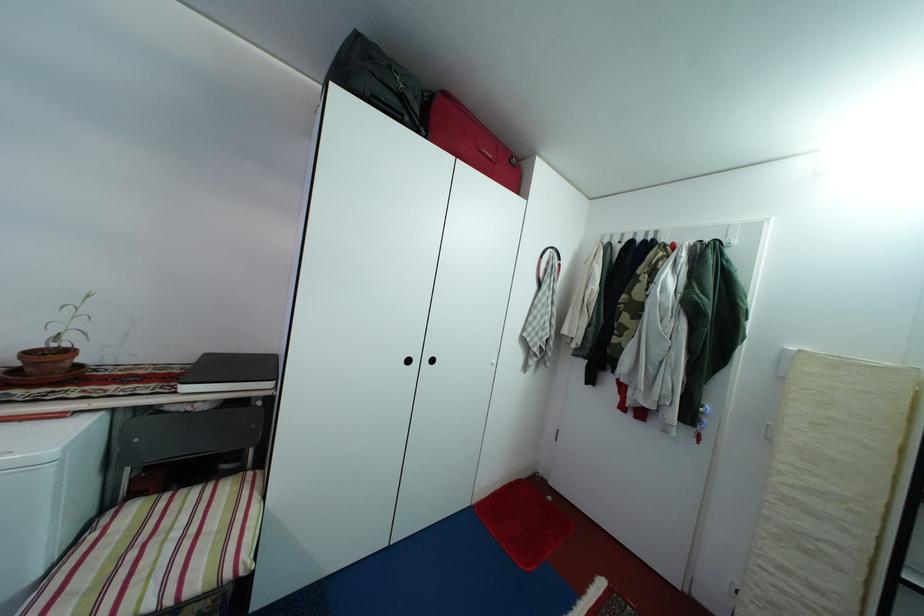
Which object does [468,139] point to?

It refers to a red suitcase.